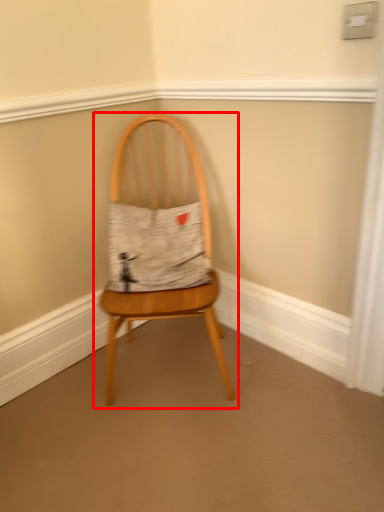
Question: From the image's perspective, considering the relative positions of chair (annotated by the red box) and fabric in the image provided, where is chair (annotated by the red box) located with respect to the staircase?

Choices:
 (A) above
 (B) below

Answer: (B)